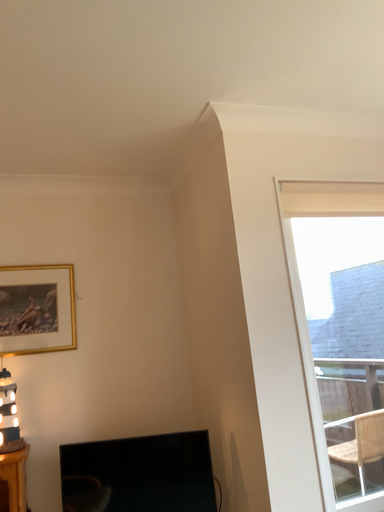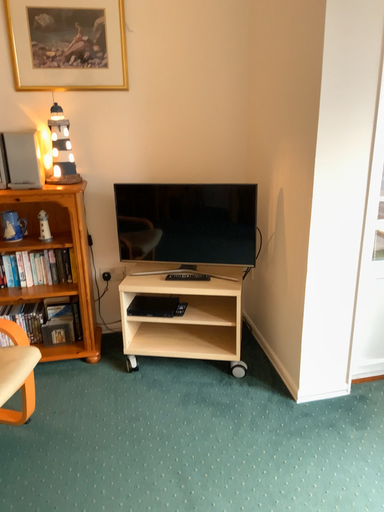
Question: How did the camera likely rotate when shooting the video?

Choices:
 (A) rotated upward
 (B) rotated downward

Answer: (B)